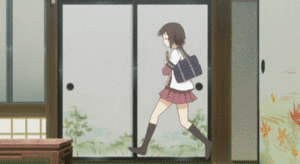
Identify the location of first two seconds show a small view of the wooden ceiling. click(265, 18), click(23, 17).